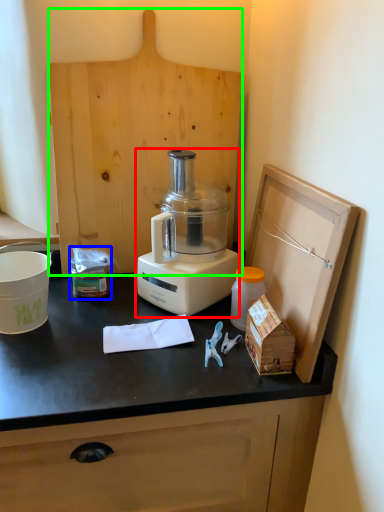
Question: Considering the real-world distances, which object is farthest from blender (highlighted by a red box)? waste (highlighted by a blue box) or wood (highlighted by a green box)?

Choices:
 (A) waste
 (B) wood

Answer: (A)